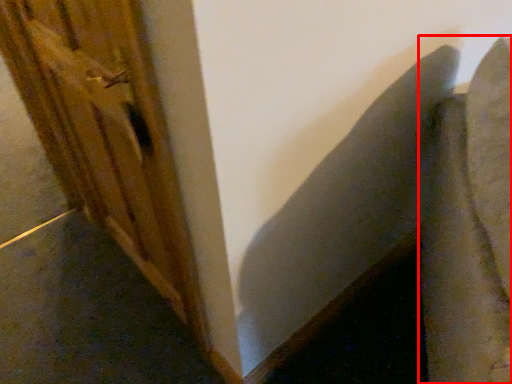
Question: From the image's perspective, considering the relative positions of swivel chair (annotated by the red box) and barn door in the image provided, where is swivel chair (annotated by the red box) located with respect to the staircase?

Choices:
 (A) above
 (B) below

Answer: (B)